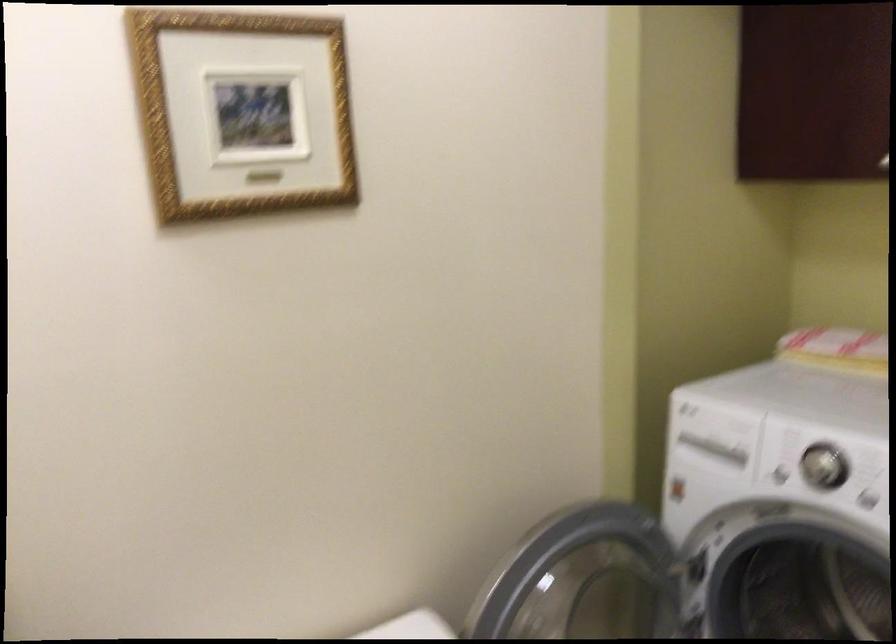
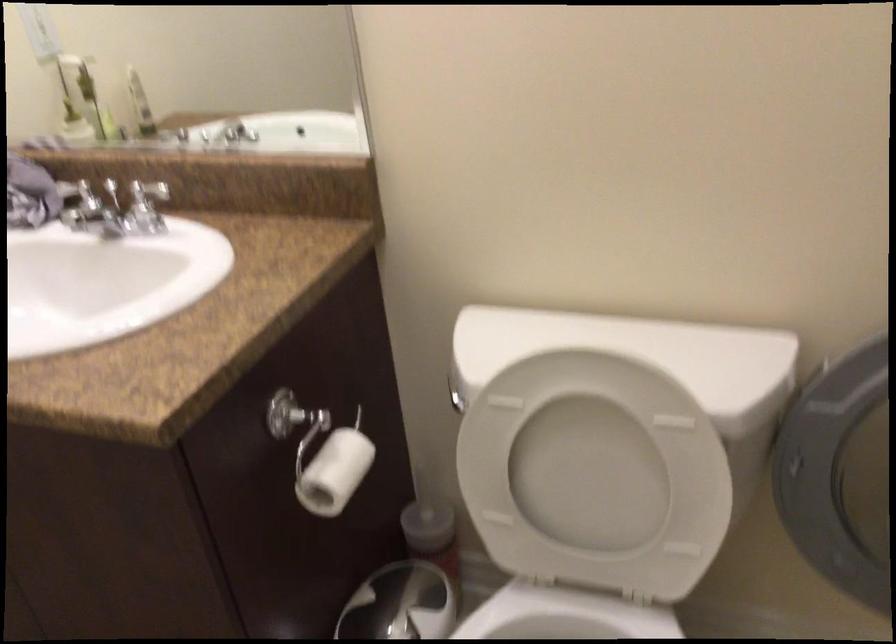
First-person continuous shooting, in which direction is the camera rotating?

The rotation direction of the camera is left-down.